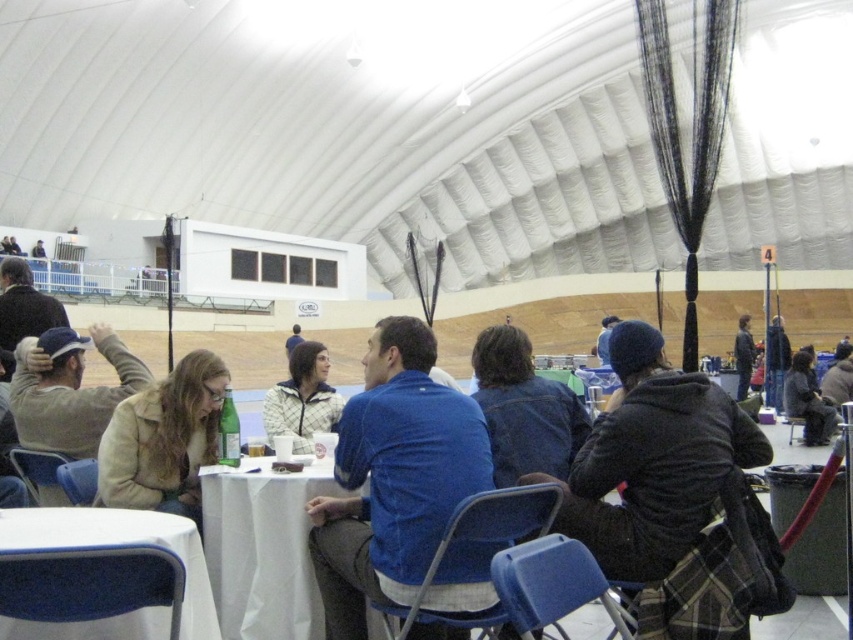
You are organizing a photo shoot in the described indoor tent setting. You have two jackets, the beige woolen jacket at center and the dark blue jacket at center, placed 30.49 meters apart. You need to position a camera 15 meters away from both jackets to capture them in the same frame. Is this possible? Explain your reasoning.

The beige woolen jacket at center and dark blue jacket at center are 30.49 meters apart. To place the camera 15 meters from both, it would need to be exactly halfway between them. Since 15 meters from each would total the 30.49 meters distance between the jackets, this is possible as the midpoint is 15.245 meters from each, which is close enough for practical purposes.

Looking at this image, you are standing in the center of the tent and want to pick up the beige woolen jacket at center. However, there is a white cloth table at center in your way. Can you reach the jacket without moving the table?

The white cloth table at center is closer to the viewer than the beige woolen jacket at center, so you cannot reach the jacket without moving the table because the table is blocking your path.

In the scene described, there is a beige woolen jacket at center and a point marked at coordinates [164,440]. Can you determine if the beige woolen jacket at center is positioned at that specific point?

The beige woolen jacket at center is located at point [164,440], so yes, the beige woolen jacket at center is positioned at that specific point.